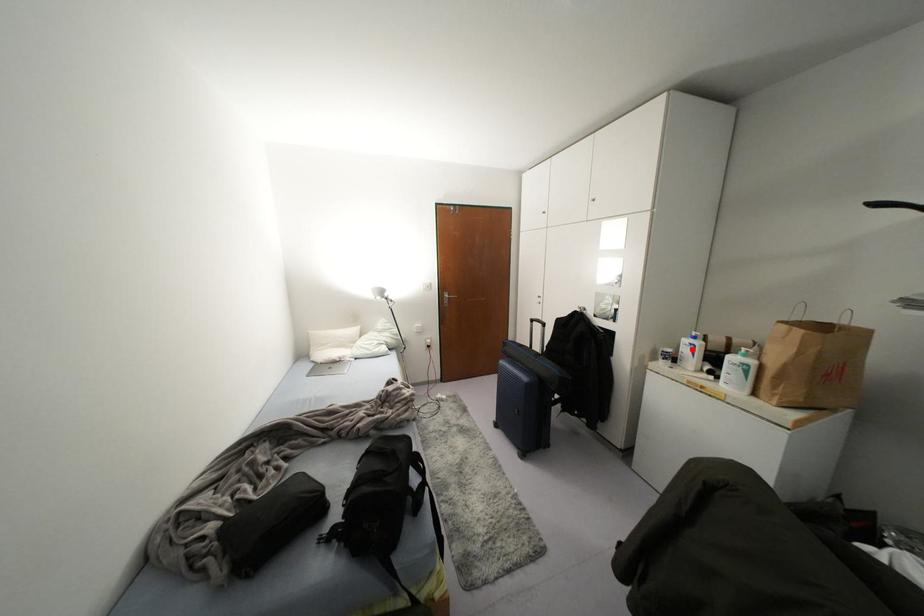
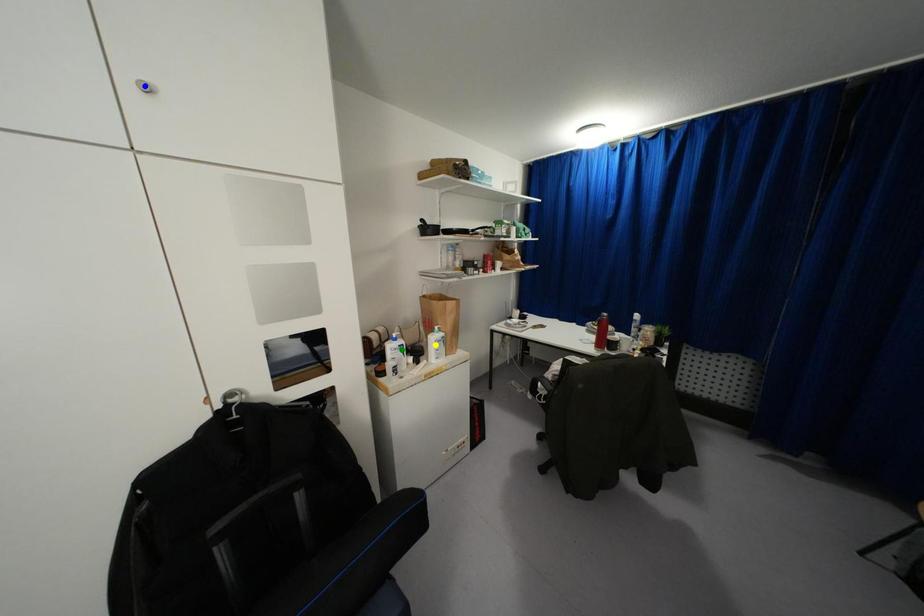
Question: I am providing you with two images of the same scene from different viewpoints. A red point is marked on the first image. You are given multiple points on the second image. Which mark in image 2 goes with the point in image 1?

Choices:
 (A) green point
 (B) yellow point
 (C) blue point

Answer: (A)